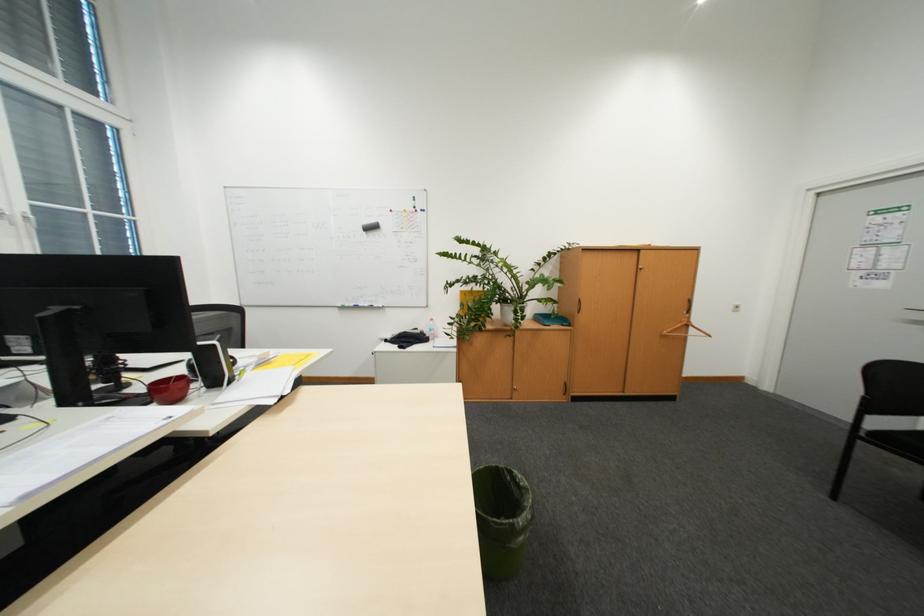
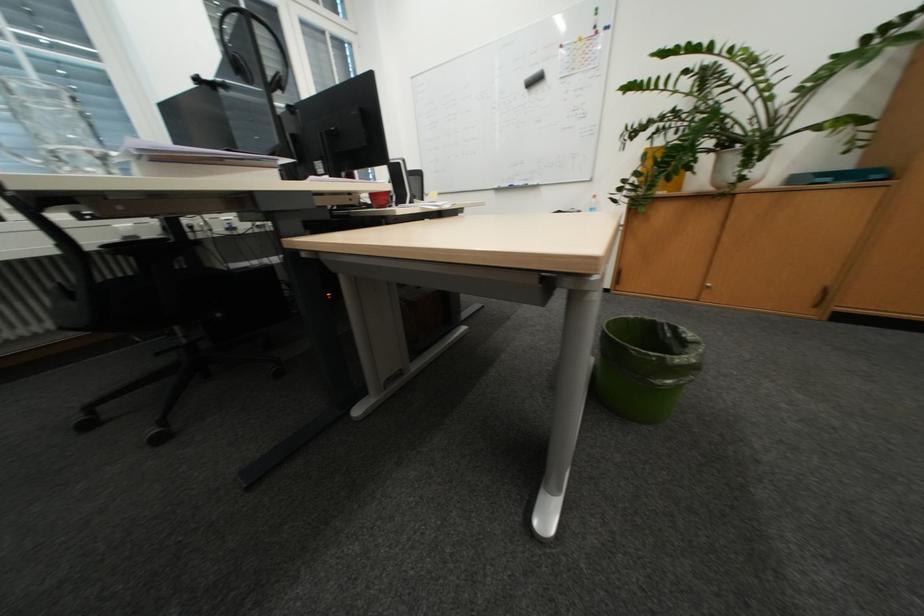
First-person continuous shooting, in which direction is the camera rotating?

The camera's rotation is toward left-down.